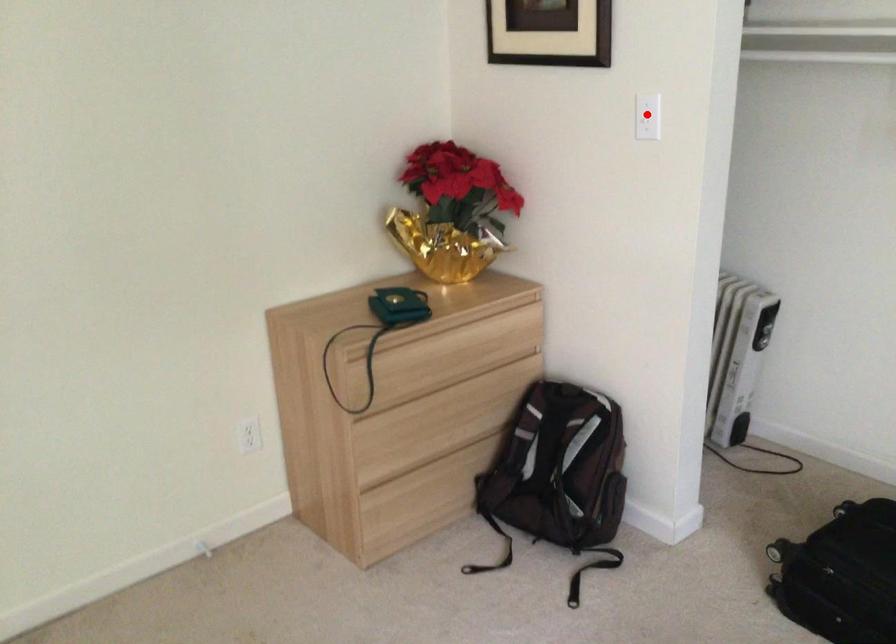
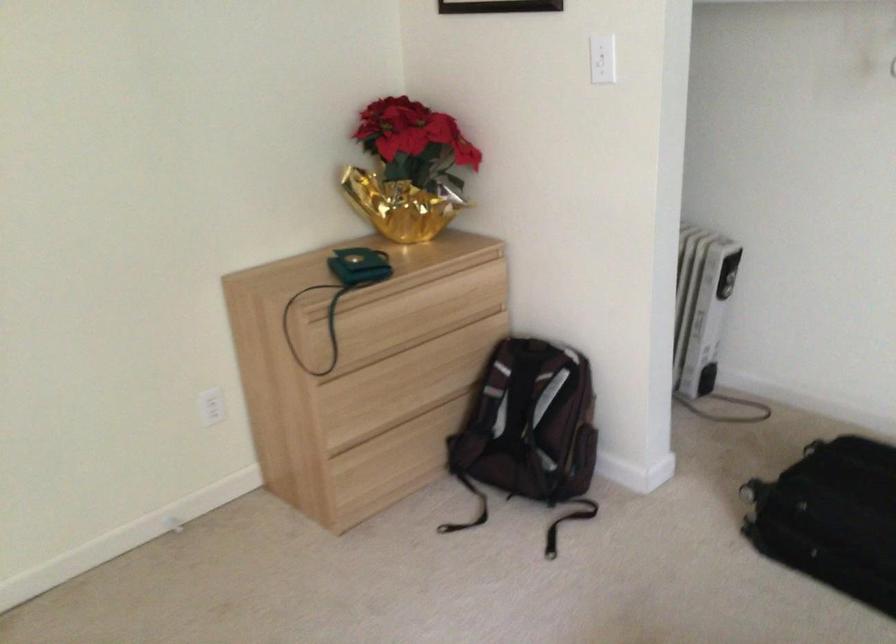
Where in the second image is the point corresponding to the highlighted location from the first image?

(601, 59)